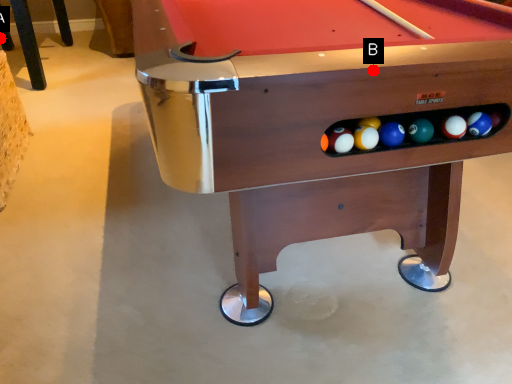
Question: Two points are circled on the image, labeled by A and B beside each circle. Which point is closer to the camera?

Choices:
 (A) A is closer
 (B) B is closer

Answer: (B)